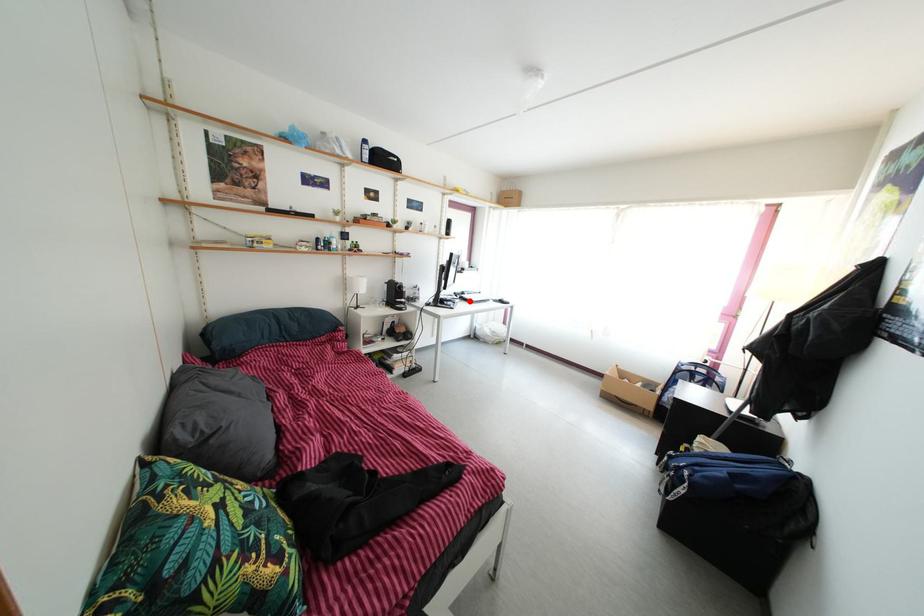
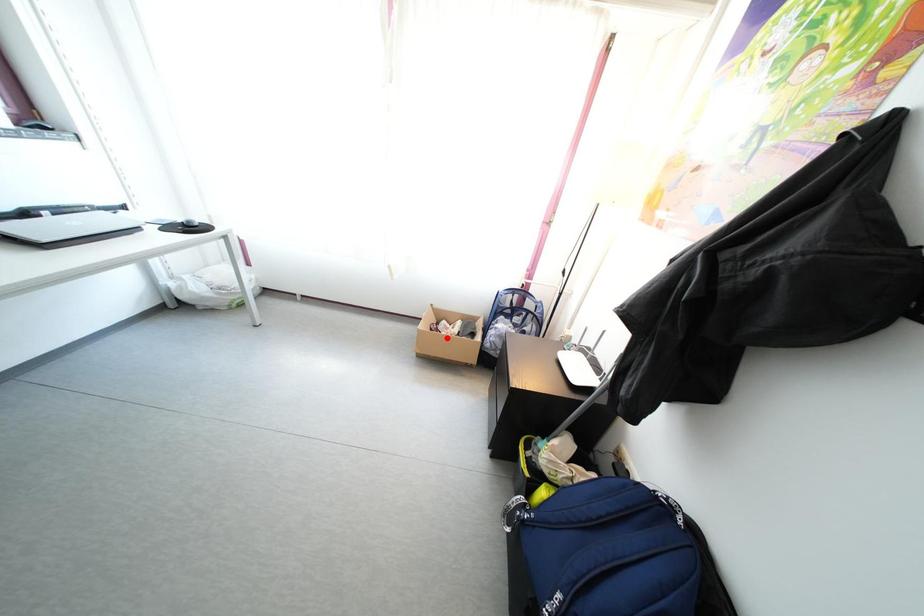
I am providing you with two images of the same scene from different viewpoints. A red point is marked on the first image and another point is marked on the second image. Does the point marked in image1 correspond to the same location as the one in image2?

No